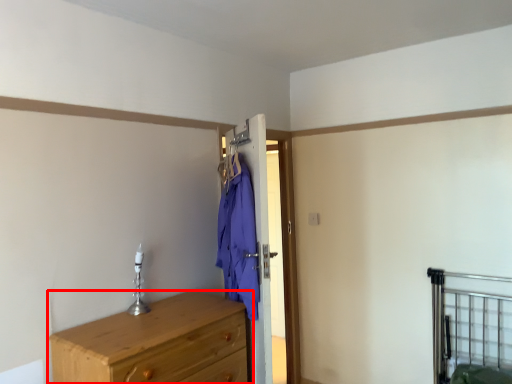
Question: From the image's perspective, what is the correct spatial positioning of chest of drawers (annotated by the red box) in reference to bed frame?

Choices:
 (A) below
 (B) above

Answer: (B)